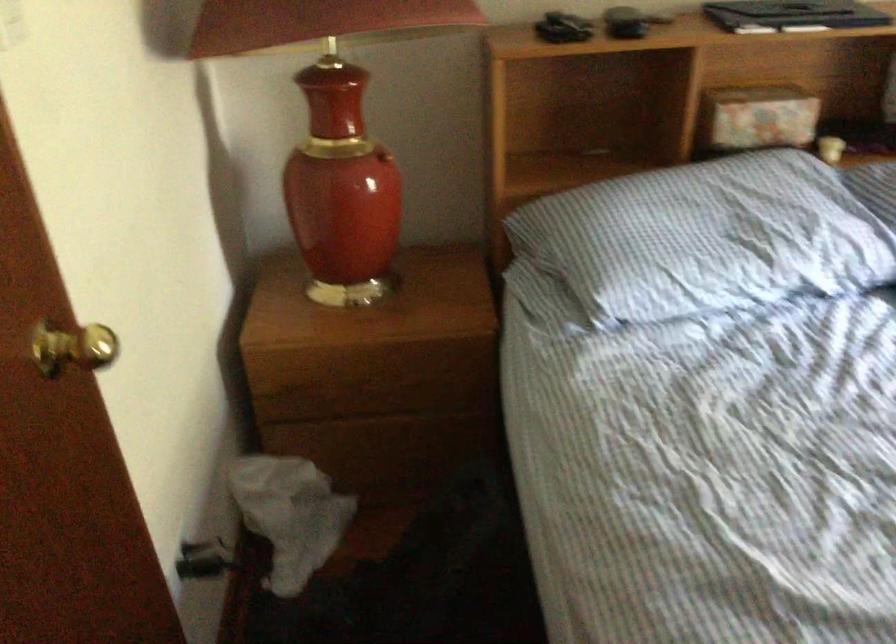
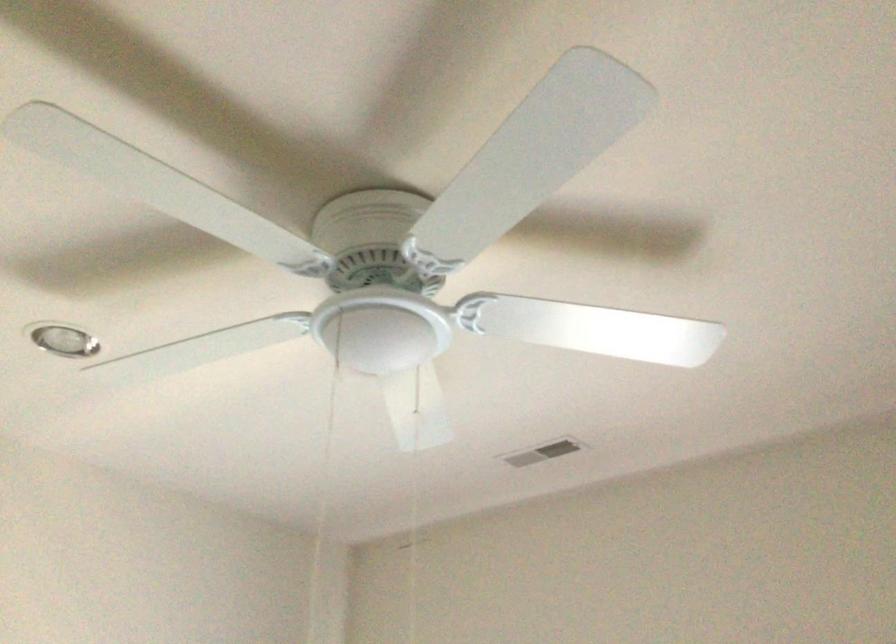
How did the camera likely rotate?

The rotation direction of the camera is right-up.